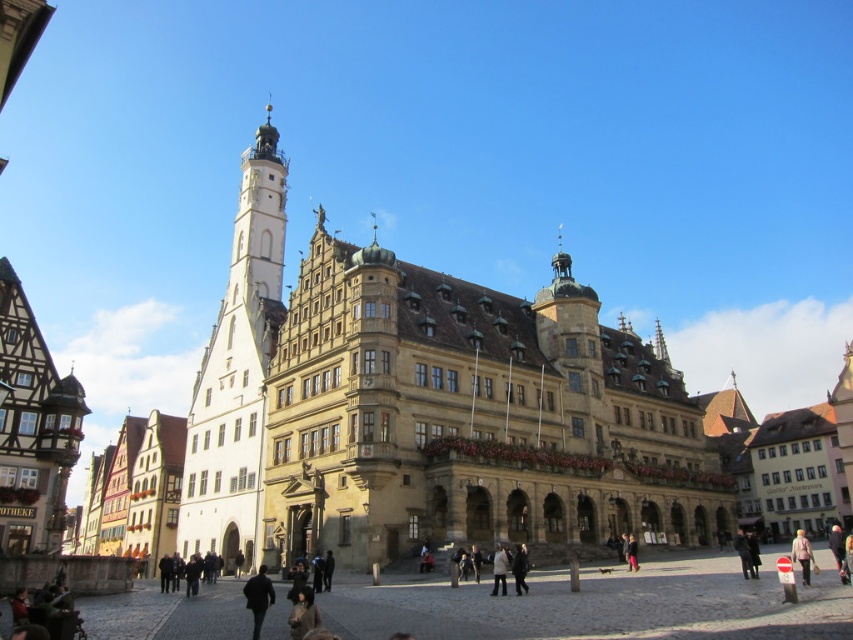
Is white stone tower at center-left positioned behind black matte jacket at center?

Yes, it is.

Who is higher up, white stone tower at center-left or black matte jacket at center?

white stone tower at center-left is above.

I want to click on white stone tower at center-left, so click(236, 371).

Find the location of a particular element. This screenshot has width=853, height=640. white stone tower at center-left is located at coordinates pos(236,371).

Who is taller, black matte jacket at center or light beige fabric coat at lower right?

Standing taller between the two is light beige fabric coat at lower right.

Identify the location of black matte jacket at center. (258, 598).

In order to click on black matte jacket at center in this screenshot , I will do `click(258, 598)`.

Which is above, white stone tower at center-left or light beige jacket at center?

white stone tower at center-left is higher up.

How distant is white stone tower at center-left from light beige jacket at center?

The distance of white stone tower at center-left from light beige jacket at center is 40.50 meters.

At what (x,y) coordinates should I click in order to perform the action: click on white stone tower at center-left. Please return your answer as a coordinate pair (x, y). Looking at the image, I should click on (236, 371).